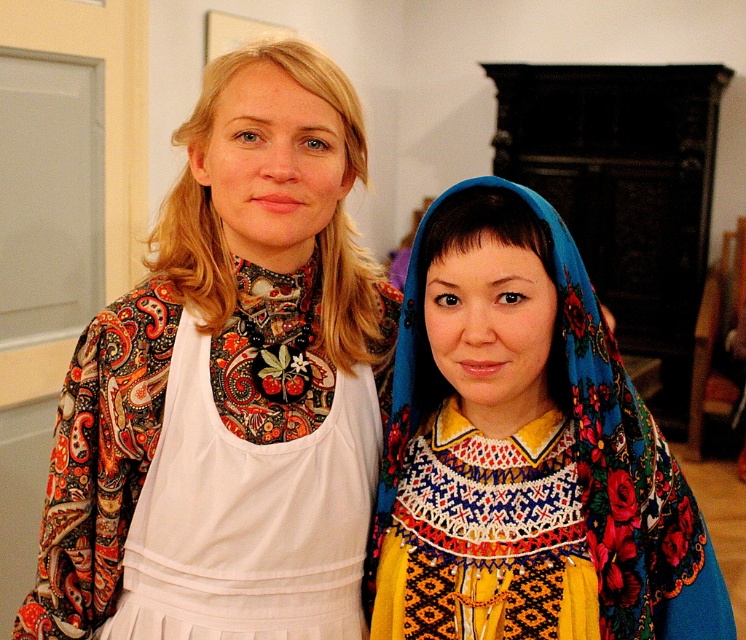
Is floral fabric headscarf at center below white fabric apron at center?

No, floral fabric headscarf at center is not below white fabric apron at center.

The height and width of the screenshot is (640, 746). What are the coordinates of `floral fabric headscarf at center` in the screenshot? It's located at (524, 451).

Is point (495, 588) farther from viewer compared to point (206, 588)?

No, (495, 588) is in front of (206, 588).

The height and width of the screenshot is (640, 746). I want to click on floral fabric headscarf at center, so click(524, 451).

Locate an element on the screen. The image size is (746, 640). matte floral kimono at center is located at coordinates (228, 387).

The width and height of the screenshot is (746, 640). Describe the element at coordinates (228, 387) in the screenshot. I see `matte floral kimono at center` at that location.

Is point (263, 193) positioned in front of point (492, 589)?

That is False.

Locate an element on the screen. This screenshot has height=640, width=746. matte floral kimono at center is located at coordinates (x=228, y=387).

Is matte floral kimono at center to the right of white fabric apron at center from the viewer's perspective?

No, matte floral kimono at center is not to the right of white fabric apron at center.

Image resolution: width=746 pixels, height=640 pixels. What are the coordinates of `matte floral kimono at center` in the screenshot? It's located at (228, 387).